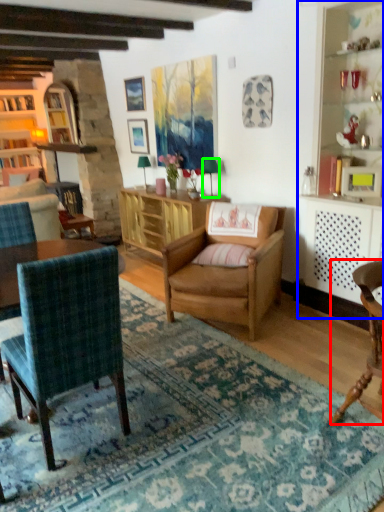
Question: Which object is the farthest from chair (highlighted by a red box)? Choose among these: dresser (highlighted by a blue box) or lamp (highlighted by a green box).

Choices:
 (A) dresser
 (B) lamp

Answer: (B)